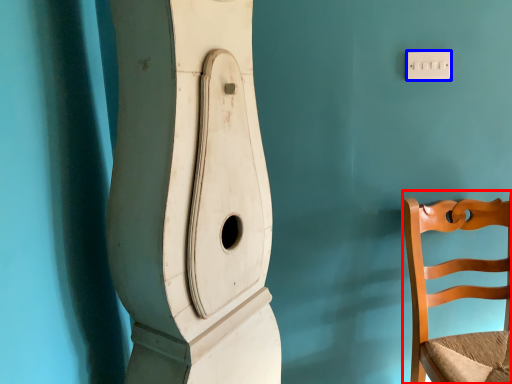
Question: Which object is closer to the camera taking this photo, chair (highlighted by a red box) or light switch (highlighted by a blue box)?

Choices:
 (A) chair
 (B) light switch

Answer: (A)